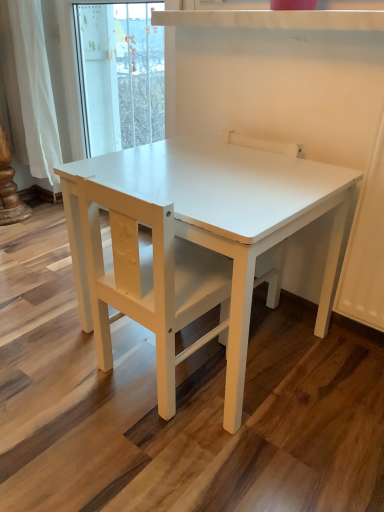
Question: Relative to white matte chair at center, is white matte table at center in front or behind?

Choices:
 (A) behind
 (B) front

Answer: (B)

Question: From a real-world perspective, is white matte table at center positioned above or below white matte chair at center?

Choices:
 (A) above
 (B) below

Answer: (B)

Question: From their relative heights in the image, would you say white matte table at center is taller or shorter than white matte chair at center?

Choices:
 (A) tall
 (B) short

Answer: (B)

Question: In terms of width, does white matte chair at center look wider or thinner when compared to white matte table at center?

Choices:
 (A) wide
 (B) thin

Answer: (B)

Question: From their relative heights in the image, would you say white matte chair at center is taller or shorter than white matte table at center?

Choices:
 (A) short
 (B) tall

Answer: (B)

Question: Is white matte chair at center inside or outside of white matte table at center?

Choices:
 (A) outside
 (B) inside

Answer: (B)

Question: Relative to white matte table at center, is white matte chair at center in front or behind?

Choices:
 (A) front
 (B) behind

Answer: (B)